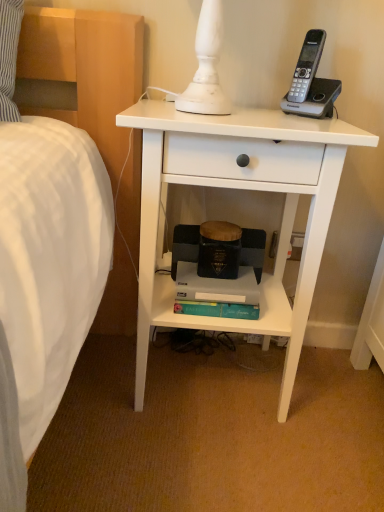
Locate an element on the screen. This screenshot has width=384, height=512. vacant region under white matte nightstand at center (from a real-world perspective) is located at coordinates tap(215, 379).